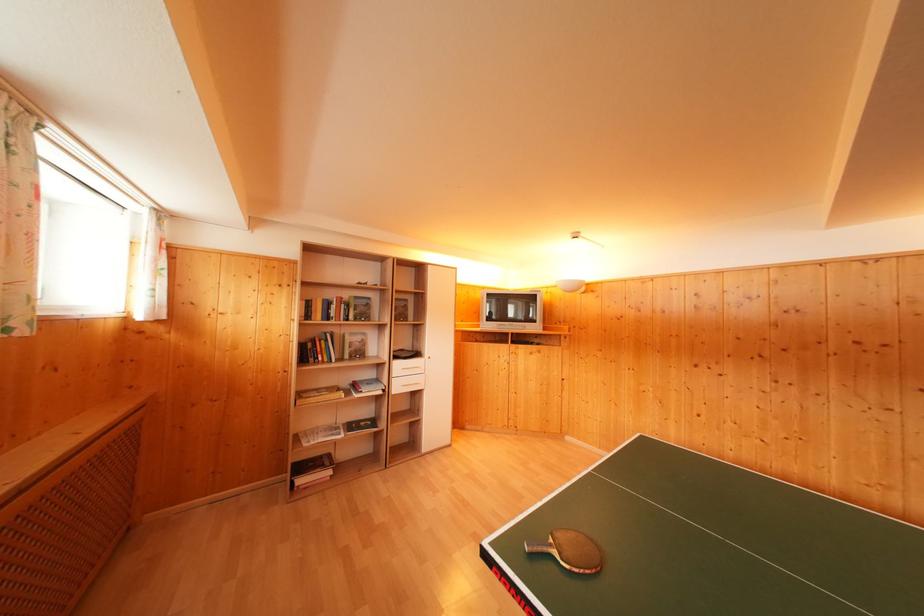
The location [569,551] corresponds to which object?

It refers to a ping pong paddle.